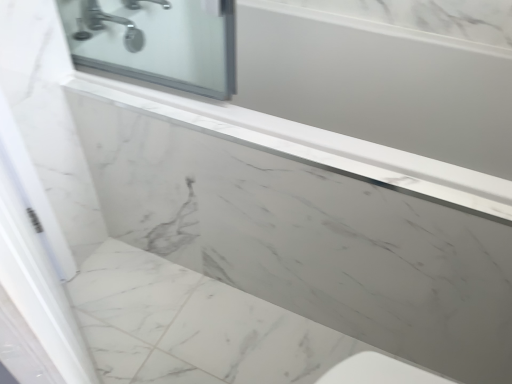
Identify the location of empty space that is to the right of white marble screen door at left. (214, 348).